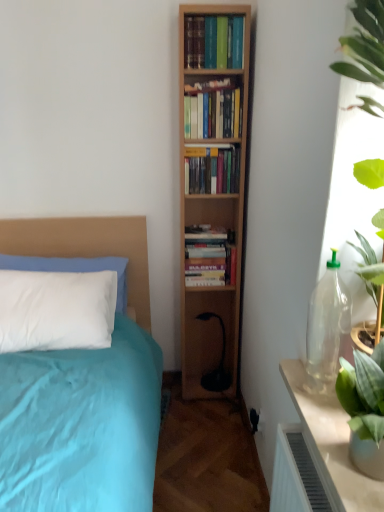
I want to click on free point above wooden bookshelf at center, which appears as the second book when viewed from the top (from a real-world perspective), so click(214, 89).